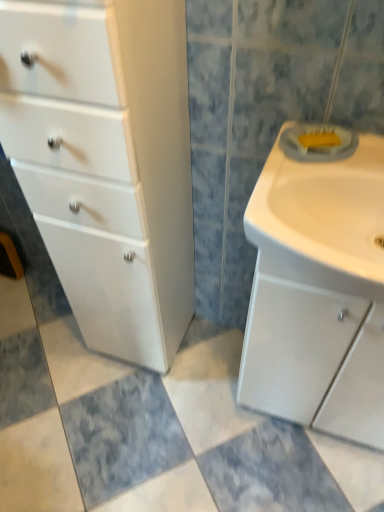
Question: Is white glossy cabinet at left touching white glossy sink at right?

Choices:
 (A) yes
 (B) no

Answer: (B)

Question: Can you confirm if white glossy cabinet at left is positioned to the right of white glossy sink at right?

Choices:
 (A) yes
 (B) no

Answer: (B)

Question: Are white glossy cabinet at left and white glossy sink at right located far from each other?

Choices:
 (A) no
 (B) yes

Answer: (A)

Question: From a real-world perspective, is white glossy cabinet at left physically below white glossy sink at right?

Choices:
 (A) no
 (B) yes

Answer: (B)

Question: Considering the relative sizes of white glossy cabinet at left and white glossy sink at right in the image provided, is white glossy cabinet at left smaller than white glossy sink at right?

Choices:
 (A) no
 (B) yes

Answer: (A)

Question: Considering the positions of white glossy sink at right and white glossy cabinet at left in the image, is white glossy sink at right wider or thinner than white glossy cabinet at left?

Choices:
 (A) thin
 (B) wide

Answer: (B)

Question: Relative to white glossy cabinet at left, is white glossy sink at right in front or behind?

Choices:
 (A) front
 (B) behind

Answer: (B)

Question: Is point pyautogui.click(x=360, y=233) closer or farther from the camera than point pyautogui.click(x=54, y=115)?

Choices:
 (A) farther
 (B) closer

Answer: (A)

Question: From a real-world perspective, is white glossy sink at right above or below white glossy cabinet at left?

Choices:
 (A) below
 (B) above

Answer: (B)

Question: Would you say white glossy sink at right is to the left or to the right of white matte sink cabinet at right in the picture?

Choices:
 (A) left
 (B) right

Answer: (A)

Question: From the image's perspective, relative to white matte sink cabinet at right, is white glossy sink at right above or below?

Choices:
 (A) below
 (B) above

Answer: (B)

Question: Is white glossy sink at right situated inside white matte sink cabinet at right or outside?

Choices:
 (A) inside
 (B) outside

Answer: (B)

Question: Based on their sizes in the image, would you say white glossy sink at right is bigger or smaller than white matte sink cabinet at right?

Choices:
 (A) big
 (B) small

Answer: (B)

Question: From the image's perspective, is white glossy cabinet at left above or below white glossy sink at right?

Choices:
 (A) above
 (B) below

Answer: (B)

Question: Is white glossy cabinet at left wider or thinner than white glossy sink at right?

Choices:
 (A) thin
 (B) wide

Answer: (A)